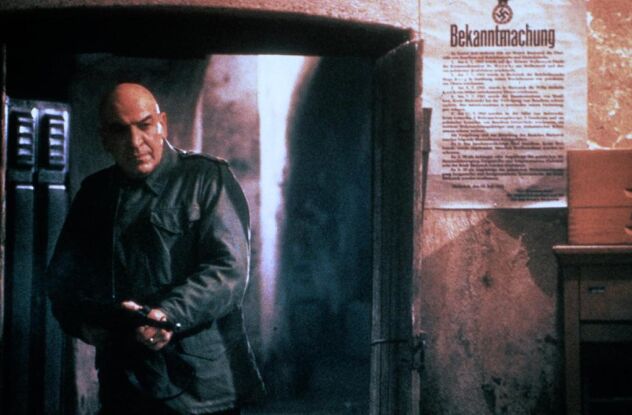
Identify the location of wooden drawers. (600, 178), (599, 215), (597, 292).